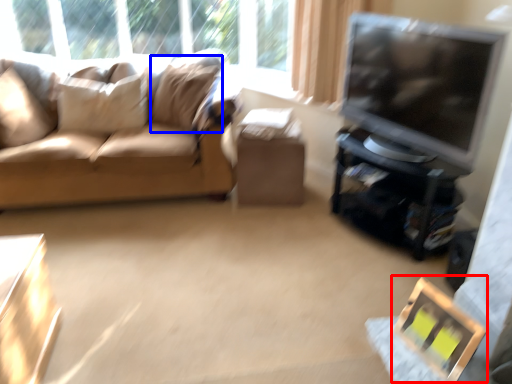
Question: Which point is closer to the camera, picture frame (highlighted by a red box) or pillow (highlighted by a blue box)?

Choices:
 (A) picture frame
 (B) pillow

Answer: (A)